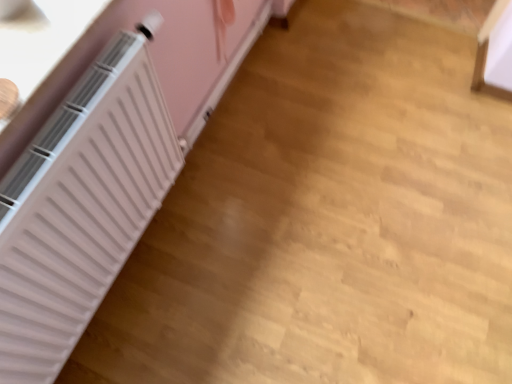
You are a GUI agent. You are given a task and a screenshot of the screen. Output one action in this format:
    pyautogui.click(x=<x>, y=<y>)
    Task: Click on the vacant area that lies to the right of white matte radiator at left
    The image size is (512, 384).
    Given the screenshot: What is the action you would take?
    pyautogui.click(x=339, y=158)